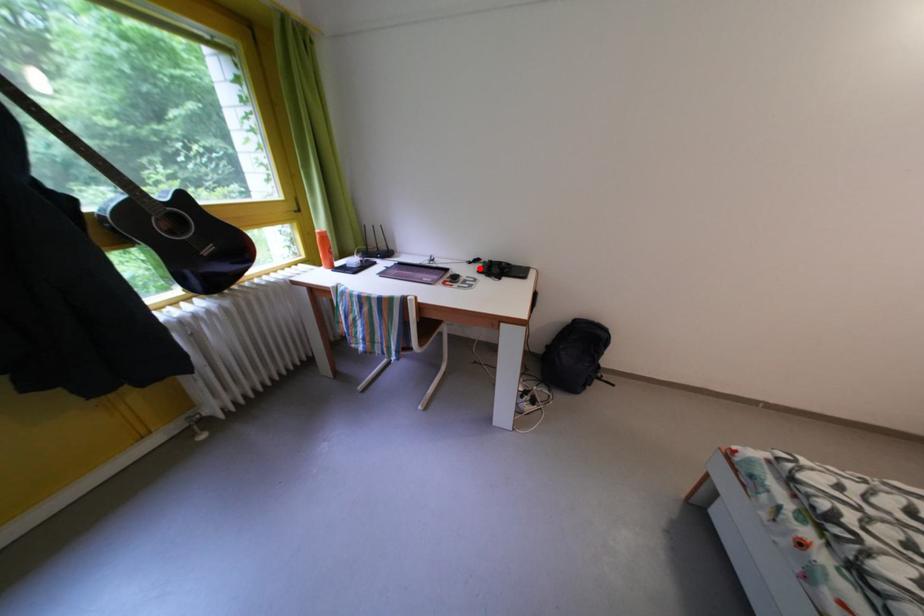
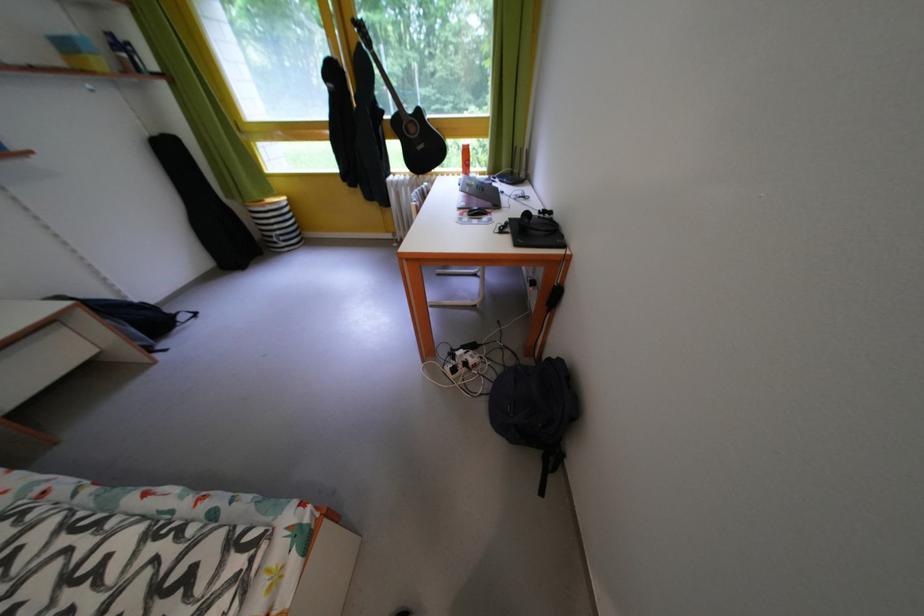
In the second image, find the point that corresponds to the highlighted location in the first image.

(550, 217)